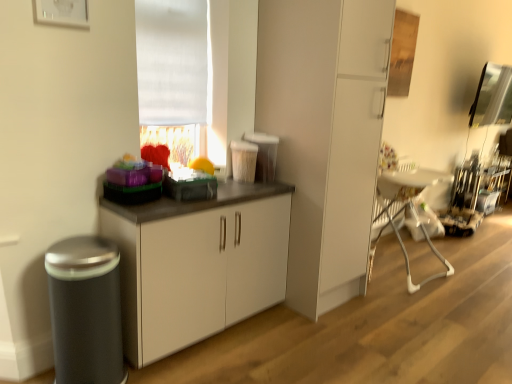
Find the location of a particular element. vacant space to the right of white plastic swivel chair at right is located at coordinates (461, 259).